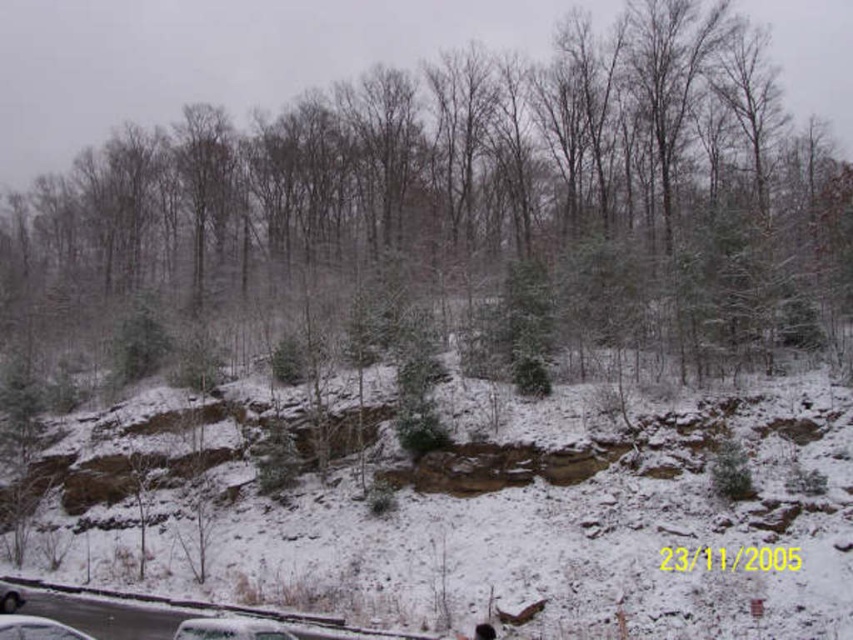
Consider the image. You are a delivery person trying to park your truck between the white matte car at lower left and the silver metallic car at lower left. The truck is 2.5 meters wide. Can you fit your truck between them?

The white matte car at lower left might be wider than silver metallic car at lower left, so it is uncertain if there is enough space for the truck. Check the actual width between them before proceeding.

You are a delivery driver who needs to park your 2.5 meter wide delivery van between the white matte car at lower left and the silver metallic car at lower left. Is there enough space for your van between them?

The white matte car at lower left and the silver metallic car at lower left are 4.18 meters apart. Since your delivery van is 2.5 meters wide, there is sufficient space between them to park your van.

You are a delivery person trying to park your vehicle in the parking lot shown in the image. There is a white glossy car at lower center and a white matte car at lower left already parked. Which car takes up more space in the parking spot?

The white matte car at lower left takes up more space in the parking spot because it is larger than the white glossy car at lower center.